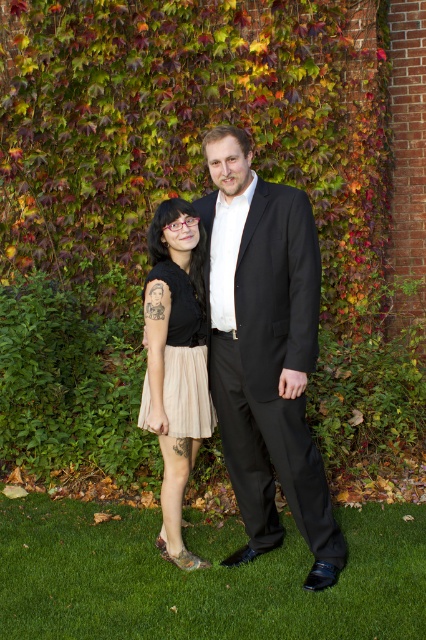
Question: Which of the following is the farthest from the observer?

Choices:
 (A) green grass at lower center
 (B) black smooth suit at center
 (C) matte black dress at center
 (D) beige pleated skirt at lower left

Answer: (C)

Question: Does green grass at lower center come behind black smooth suit at center?

Choices:
 (A) no
 (B) yes

Answer: (A)

Question: Which point appears farthest from the camera in this image?

Choices:
 (A) [x=299, y=298]
 (B) [x=164, y=342]
 (C) [x=276, y=586]

Answer: (B)

Question: In this image, where is black smooth suit at center located relative to matte black dress at center?

Choices:
 (A) above
 (B) below

Answer: (A)

Question: Does matte black dress at center appear on the right side of beige pleated skirt at lower left?

Choices:
 (A) yes
 (B) no

Answer: (B)

Question: Among these points, which one is farthest from the camera?

Choices:
 (A) (299, 474)
 (B) (193, 333)
 (C) (89, 506)

Answer: (C)